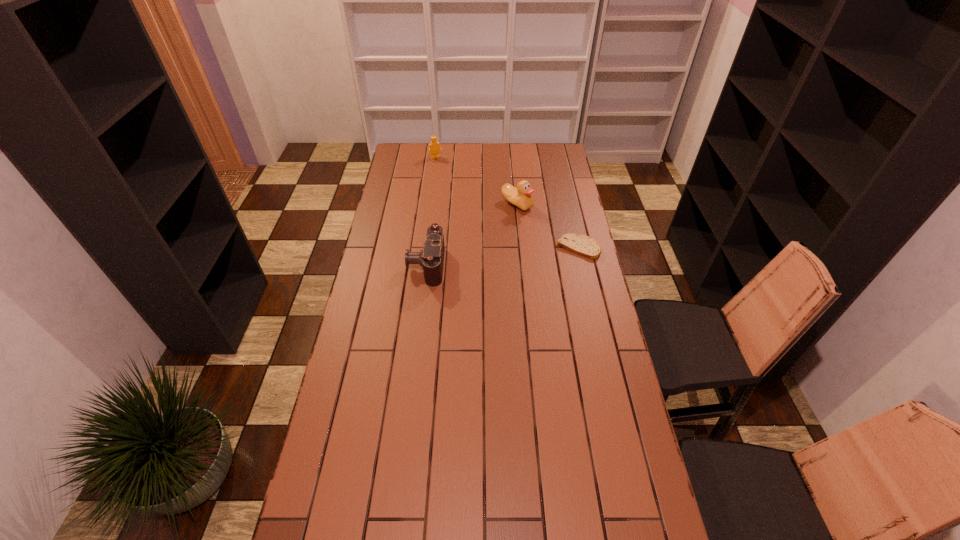
Locate an element on the screen. camera is located at coordinates (431, 258).

This screenshot has width=960, height=540. Find the location of `pita bread`. pita bread is located at coordinates (583, 245).

At what (x,y) coordinates should I click in order to perform the action: click on the shortest object. Please return your answer as a coordinate pair (x, y). Looking at the image, I should click on (583, 245).

This screenshot has height=540, width=960. In order to click on Lego in this screenshot , I will do point(434,146).

Locate an element on the screen. The width and height of the screenshot is (960, 540). the third object from left to right is located at coordinates (520, 197).

The height and width of the screenshot is (540, 960). What are the coordinates of `the second farthest object` in the screenshot? It's located at (520, 197).

The height and width of the screenshot is (540, 960). Identify the location of vacant space located 0.070m on the front-facing side of the camera. (391, 265).

Where is `free location located on the front of the pita bread`? The height and width of the screenshot is (540, 960). free location located on the front of the pita bread is located at coordinates (585, 278).

What are the coordinates of `vacant space located on the face of the Lego` in the screenshot? It's located at pyautogui.click(x=446, y=176).

Locate an element on the screen. free region located on the face of the Lego is located at coordinates (448, 179).